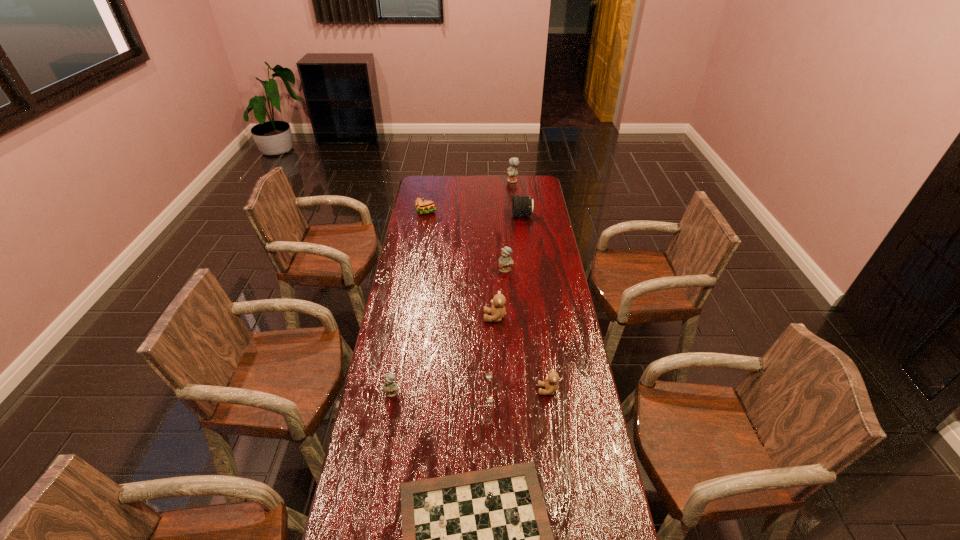
I want to click on the nearest blue teddy bear, so click(x=390, y=387).

I want to click on the leftmost blue teddy bear, so click(x=390, y=387).

At what (x,y) coordinates should I click in order to perform the action: click on the shortest object. Please return your answer as a coordinate pair (x, y). This screenshot has height=540, width=960. Looking at the image, I should click on (x=488, y=374).

I want to click on free space located 0.180m on the front-facing side of the biggest blue teddy bear, so click(476, 181).

I want to click on free location located on the front-facing side of the biggest blue teddy bear, so pyautogui.click(x=457, y=181).

Where is `blank space located on the front-facing side of the biggest blue teddy bear`? The height and width of the screenshot is (540, 960). blank space located on the front-facing side of the biggest blue teddy bear is located at coordinates (468, 181).

This screenshot has height=540, width=960. In order to click on vacant region located 0.060m on the face of the third nearest teddy bear in this screenshot , I will do `click(468, 318)`.

Identify the location of vacant space situated 0.290m on the face of the third nearest teddy bear. The width and height of the screenshot is (960, 540). (411, 318).

The image size is (960, 540). I want to click on free point located 0.390m on the face of the third nearest teddy bear, so click(386, 318).

Locate an element on the screen. free space located 0.210m on the front-facing side of the second blue teddy bear from left to right is located at coordinates (508, 307).